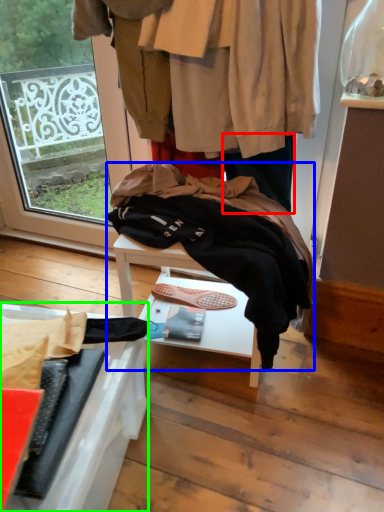
Question: Considering the real-world distances, which object is farthest from trousers (highlighted by a red box)? wool (highlighted by a blue box) or furniture (highlighted by a green box)?

Choices:
 (A) wool
 (B) furniture

Answer: (B)